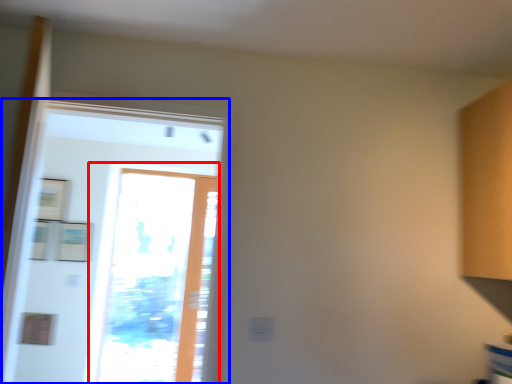
Question: Which of the following is the closest to the observer, window (highlighted by a red box) or screen door (highlighted by a blue box)?

Choices:
 (A) window
 (B) screen door

Answer: (B)